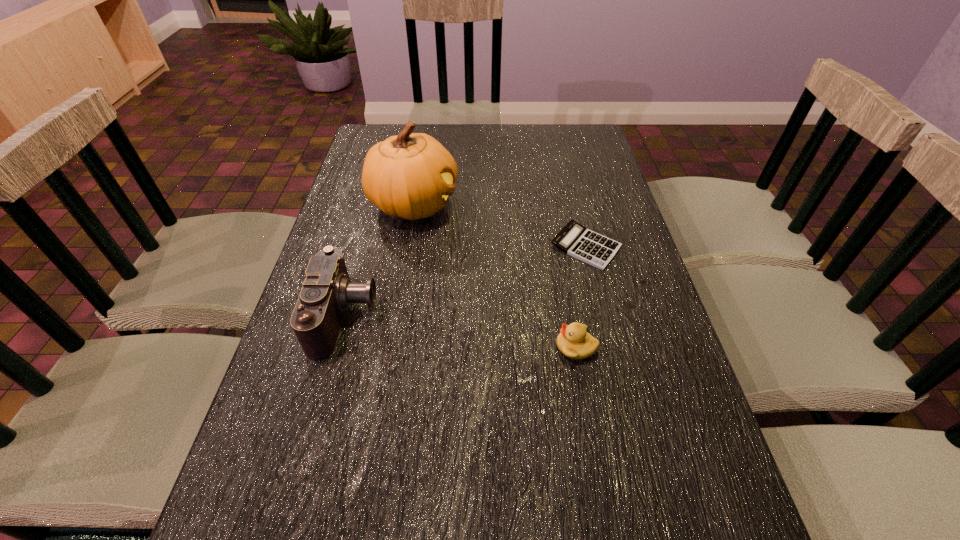
The image size is (960, 540). In order to click on unoccupied area between the calculator and the pumpkin in this screenshot , I will do `click(500, 226)`.

Find the location of a particular element. free point between the third shortest object and the calculator is located at coordinates (466, 281).

Locate an element on the screen. vacant area between the pumpkin and the second tallest object is located at coordinates (379, 261).

Find the location of a particular element. This screenshot has height=540, width=960. free space between the third tallest object and the camera is located at coordinates (461, 332).

Where is `vacant area that lies between the tallest object and the third tallest object`? vacant area that lies between the tallest object and the third tallest object is located at coordinates (495, 275).

In order to click on vacant point located between the second tallest object and the duckling in this screenshot , I will do `click(461, 332)`.

The height and width of the screenshot is (540, 960). Find the location of `empty location between the third shortest object and the shortest object`. empty location between the third shortest object and the shortest object is located at coordinates (466, 281).

Where is `vacant region between the second shortest object and the tallest object`? The width and height of the screenshot is (960, 540). vacant region between the second shortest object and the tallest object is located at coordinates click(x=495, y=275).

Identify which object is the third nearest to the shortest object. Please provide its 2D coordinates. Your answer should be formatted as a tuple, i.e. [(x, y)], where the tuple contains the x and y coordinates of a point satisfying the conditions above.

[(327, 292)]

Select which object is the closest to the calculator. Please provide its 2D coordinates. Your answer should be formatted as a tuple, i.e. [(x, y)], where the tuple contains the x and y coordinates of a point satisfying the conditions above.

[(574, 341)]